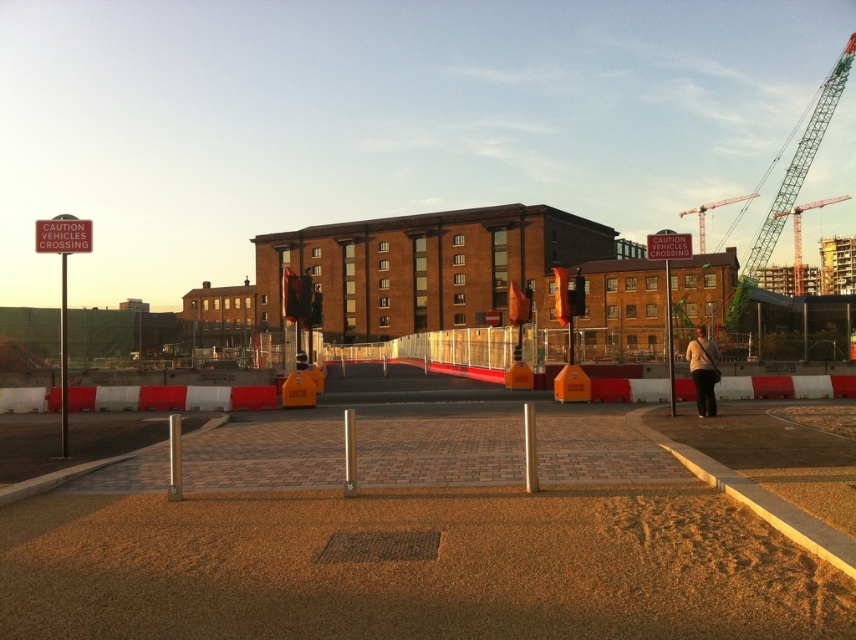
The width and height of the screenshot is (856, 640). What do you see at coordinates (63, 234) in the screenshot? I see `red plastic sign at upper left` at bounding box center [63, 234].

Is red plastic sign at upper left thinner than red plastic sign at upper center?

No, red plastic sign at upper left is not thinner than red plastic sign at upper center.

Which is behind, point (48, 240) or point (658, 253)?

Point (658, 253)

Locate an element on the screen. The image size is (856, 640). red plastic sign at upper left is located at coordinates (63, 234).

Can you confirm if red plastic sign at upper center is smaller than green metallic crane at upper right?

Yes.

Is red plastic sign at upper center above green metallic crane at upper right?

Incorrect, red plastic sign at upper center is not positioned above green metallic crane at upper right.

Between point (669, 250) and point (747, 198), which one is positioned behind?

The point (747, 198) is behind.

The width and height of the screenshot is (856, 640). In order to click on red plastic sign at upper center in this screenshot , I will do `click(669, 244)`.

Which is in front, point (738, 285) or point (652, 253)?

Point (652, 253)

Identify the location of green metal crane at upper right. (789, 182).

Describe the element at coordinates (789, 182) in the screenshot. The height and width of the screenshot is (640, 856). I see `green metal crane at upper right` at that location.

This screenshot has height=640, width=856. What are the coordinates of `green metal crane at upper right` in the screenshot? It's located at (789, 182).